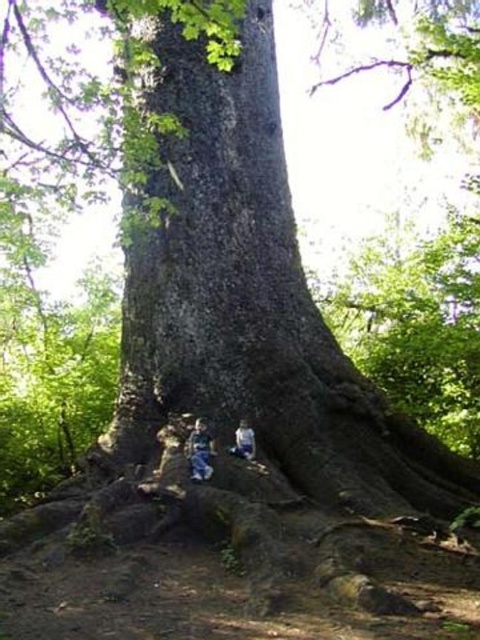
Question: Which point appears closest to the camera in this image?

Choices:
 (A) (180, 38)
 (B) (252, 452)
 (C) (189, 444)

Answer: (C)

Question: Which point is farther to the camera?

Choices:
 (A) green rough bark at center
 (B) blue denim jeans at lower center
 (C) light blue denim jeans at lower center

Answer: (C)

Question: Is blue denim jeans at lower center above light blue denim jeans at lower center?

Choices:
 (A) no
 (B) yes

Answer: (A)

Question: Among these objects, which one is farthest from the camera?

Choices:
 (A) green rough bark at center
 (B) light blue denim jeans at lower center

Answer: (B)

Question: Can you confirm if green rough bark at center is positioned to the right of light blue denim jeans at lower center?

Choices:
 (A) yes
 (B) no

Answer: (B)

Question: Is blue denim jeans at lower center further to camera compared to light blue denim jeans at lower center?

Choices:
 (A) yes
 (B) no

Answer: (B)